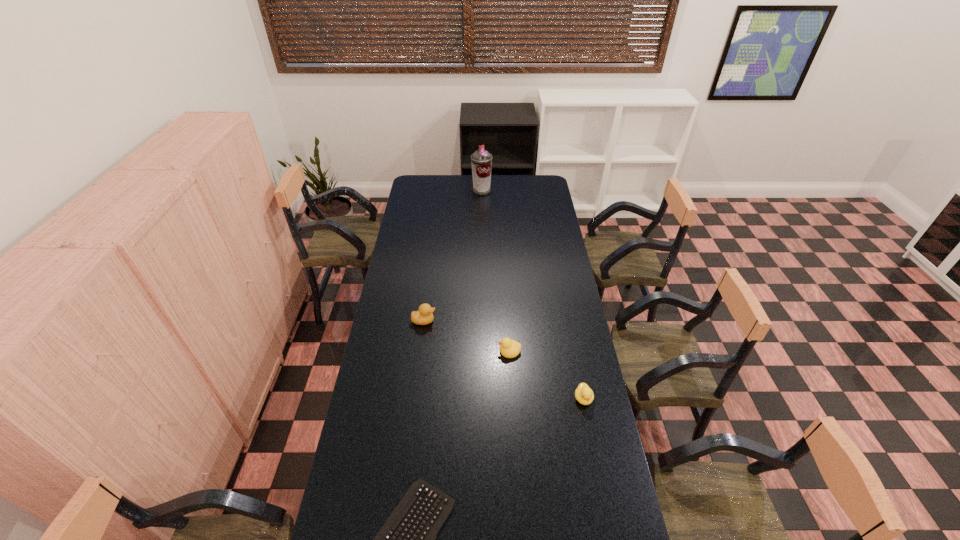
Locate an element on the screen. This screenshot has height=540, width=960. blank space at the far left corner of the desktop is located at coordinates (431, 187).

Identify the location of vacant area at the far right corner. The width and height of the screenshot is (960, 540). (530, 178).

At what (x,y) coordinates should I click in order to perform the action: click on free area in between the fourth shortest object and the second nearest object. Please return your answer as a coordinate pair (x, y). Image resolution: width=960 pixels, height=540 pixels. Looking at the image, I should click on (504, 360).

Where is `free area in between the tallest object and the second tallest object`? free area in between the tallest object and the second tallest object is located at coordinates (453, 255).

Locate an element on the screen. This screenshot has height=540, width=960. free spot between the rightmost object and the tallest object is located at coordinates (533, 294).

Locate an element on the screen. free space that is in between the tallest object and the second duckling from left to right is located at coordinates (495, 271).

Locate an element on the screen. The width and height of the screenshot is (960, 540). free space between the second object from right to left and the fourth nearest object is located at coordinates (467, 336).

Find the location of a particular element. This screenshot has width=960, height=540. free space between the tallest object and the fourth farthest object is located at coordinates (533, 294).

The image size is (960, 540). In order to click on vacant space that's between the nearest duckling and the second duckling from right to left in this screenshot , I will do `click(546, 375)`.

Select which object is the closest to the leftmost duckling. Please provide its 2D coordinates. Your answer should be formatted as a tuple, i.e. [(x, y)], where the tuple contains the x and y coordinates of a point satisfying the conditions above.

[(509, 348)]